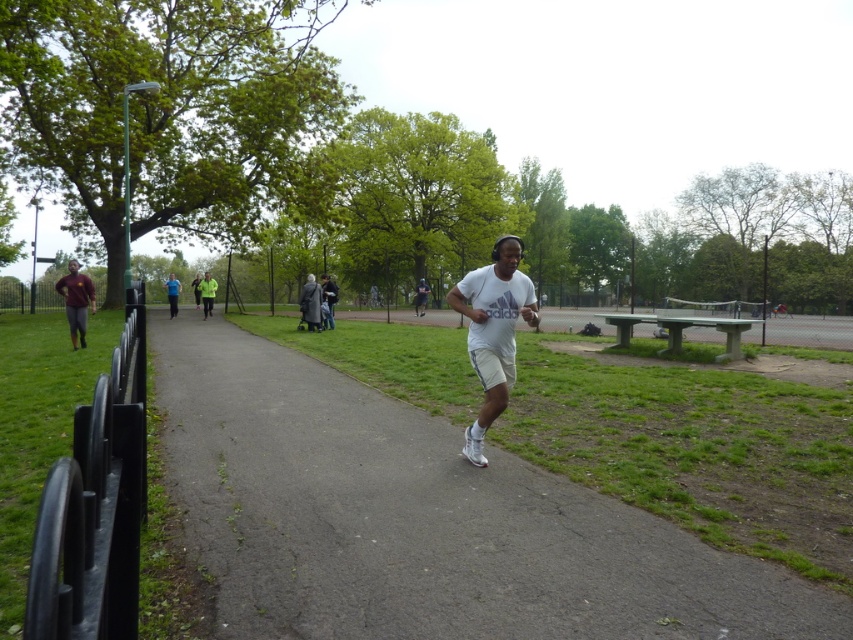
Question: Based on their relative distances, which object is nearer to the neon green jacket at center?

Choices:
 (A) gray asphalt pavement at center
 (B) maroon jersey at left
 (C) white matte t-shirt at center

Answer: (B)

Question: Is neon green jacket at center above blue fabric shirt at center?

Choices:
 (A) yes
 (B) no

Answer: (B)

Question: Which object is closer to the camera taking this photo?

Choices:
 (A) maroon jersey at left
 (B) white matte t-shirt at center
 (C) blue fabric shirt at center
 (D) gray asphalt pavement at center

Answer: (D)

Question: Can you confirm if white matte t-shirt at center is positioned above neon green jacket at center?

Choices:
 (A) yes
 (B) no

Answer: (B)

Question: Considering the real-world distances, which object is farthest from the maroon jersey at left?

Choices:
 (A) neon green jacket at center
 (B) blue fabric shirt at center
 (C) gray asphalt pavement at center
 (D) white matte t-shirt at center

Answer: (B)

Question: Is gray asphalt pavement at center further to the viewer compared to blue fabric shirt at center?

Choices:
 (A) no
 (B) yes

Answer: (A)